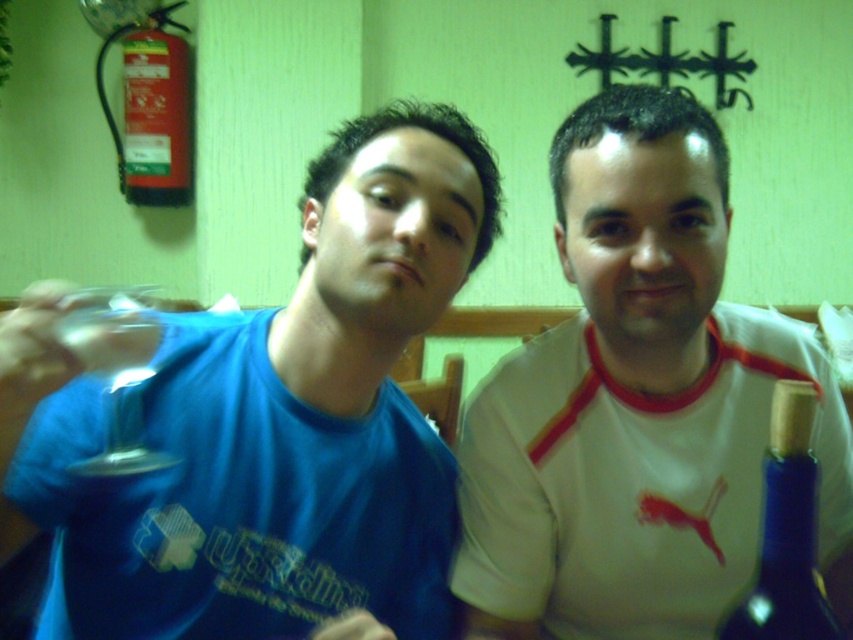
Question: Which of the following is the farthest from the observer?

Choices:
 (A) (444, 147)
 (B) (103, 467)
 (C) (619, 192)

Answer: (A)

Question: Which point is farther to the camera?

Choices:
 (A) (355, 540)
 (B) (149, 330)

Answer: (A)

Question: Can you confirm if matte blue t-shirt at center is positioned to the left of transparent glass at left?

Choices:
 (A) no
 (B) yes

Answer: (A)

Question: Does matte blue t-shirt at center appear under transparent glass at left?

Choices:
 (A) yes
 (B) no

Answer: (A)

Question: Can you confirm if matte blue t-shirt at center is positioned to the right of transparent glass at left?

Choices:
 (A) yes
 (B) no

Answer: (A)

Question: Which object is closer to the camera taking this photo?

Choices:
 (A) white matte shirt at center
 (B) blue glass bottle at right
 (C) transparent glass at left

Answer: (C)